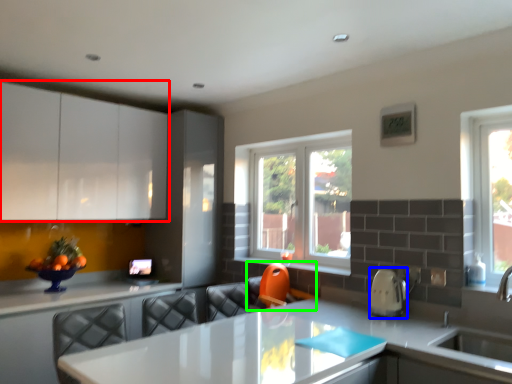
Question: Which object is positioned farthest from cabinetry (highlighted by a red box)? Select from appliance (highlighted by a blue box) and swivel chair (highlighted by a green box).

Choices:
 (A) appliance
 (B) swivel chair

Answer: (A)